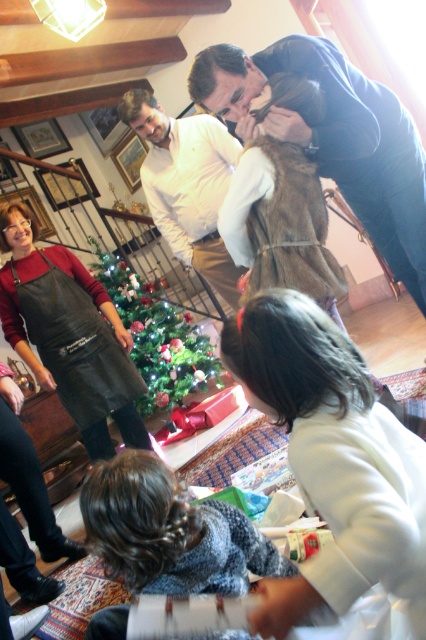
Is point (417, 269) closer to viewer compared to point (28, 332)?

Yes.

Is dark blue sweater at upper center further to camera compared to black leather apron at left?

That is False.

Is point (416, 282) closer to viewer compared to point (23, 236)?

Yes, point (416, 282) is in front of point (23, 236).

Where is `dark blue sweater at upper center`? The height and width of the screenshot is (640, 426). dark blue sweater at upper center is located at coordinates (334, 138).

Does brown fur vest at center appear over white shirt at upper center?

No.

Does brown fur vest at center have a lesser height compared to white shirt at upper center?

Yes, brown fur vest at center is shorter than white shirt at upper center.

Is point (242, 227) in front of point (180, 150)?

Yes, it is.

The image size is (426, 640). I want to click on brown fur vest at center, so click(x=281, y=224).

Between white matte jacket at lower right and green shiny christmas tree at center, which one appears on the left side from the viewer's perspective?

green shiny christmas tree at center is more to the left.

Image resolution: width=426 pixels, height=640 pixels. Identify the location of white matte jacket at lower right. (333, 458).